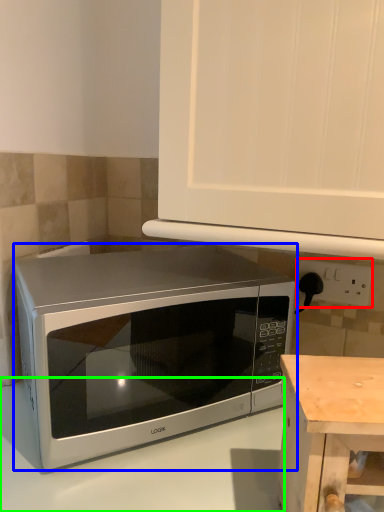
Question: Which object is the farthest from electric outlet (highlighted by a red box)? Choose among these: microwave oven (highlighted by a blue box) or counter top (highlighted by a green box).

Choices:
 (A) microwave oven
 (B) counter top

Answer: (B)